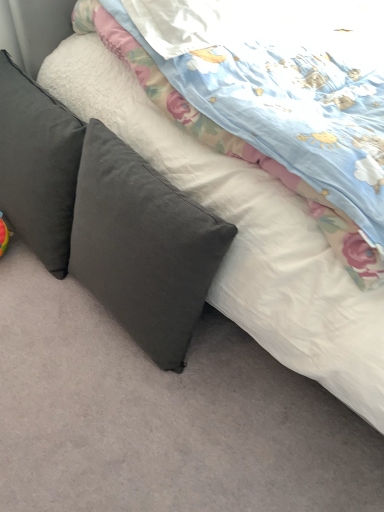
Where is `free space that is in between dark gray fabric pillow at left, marked as the 1th pillow in a left-to-right arrangement, and dark gray fabric pillow at left, which ranks as the 1th pillow in right-to-left order`? free space that is in between dark gray fabric pillow at left, marked as the 1th pillow in a left-to-right arrangement, and dark gray fabric pillow at left, which ranks as the 1th pillow in right-to-left order is located at coordinates (84, 315).